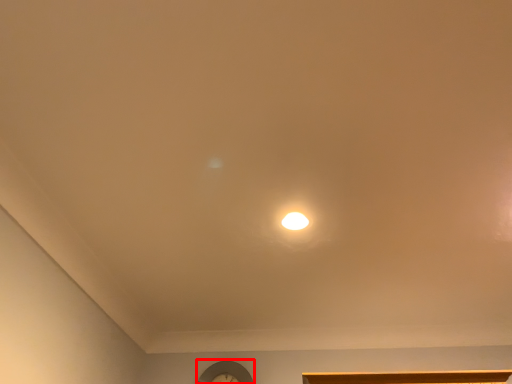
Question: Considering the relative positions of clock (annotated by the red box) and lamp in the image provided, where is clock (annotated by the red box) located with respect to the staircase?

Choices:
 (A) right
 (B) left

Answer: (B)